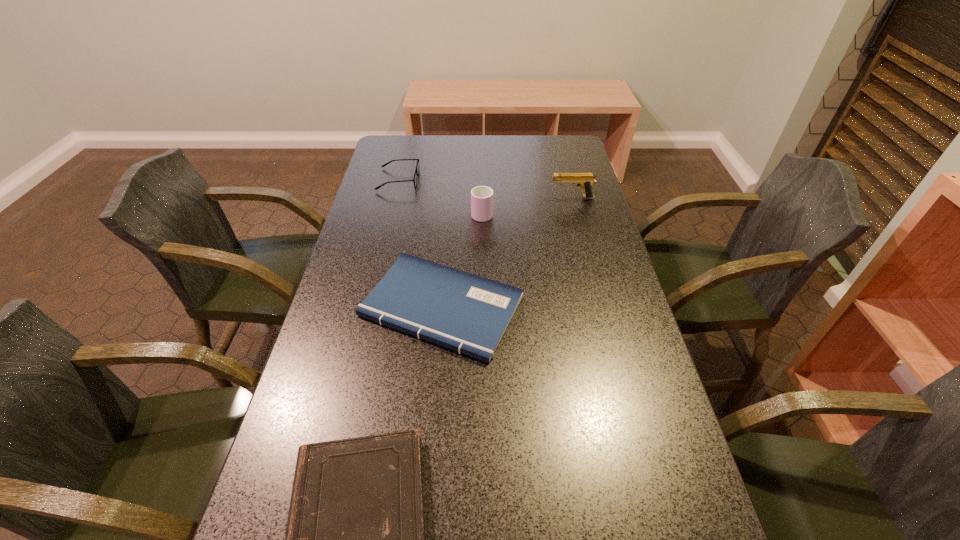
Locate an element on the screen. This screenshot has width=960, height=540. the second farthest object is located at coordinates (585, 181).

Image resolution: width=960 pixels, height=540 pixels. Find the location of `pistol`. pistol is located at coordinates (585, 181).

The height and width of the screenshot is (540, 960). What are the coordinates of `cup` in the screenshot? It's located at (481, 196).

Locate an element on the screen. spectacles is located at coordinates (416, 173).

Find the location of a particular element. the third tallest object is located at coordinates (416, 173).

I want to click on the farther paperback book, so click(461, 311).

Locate an element on the screen. The height and width of the screenshot is (540, 960). free space located at the barrel of the pistol is located at coordinates (514, 198).

At what (x,y) coordinates should I click in order to perform the action: click on vacant space located at the barrel of the pistol. Please return your answer as a coordinate pair (x, y). Looking at the image, I should click on (535, 198).

Where is `vacant space located 0.120m at the barrel of the pistol`? This screenshot has height=540, width=960. vacant space located 0.120m at the barrel of the pistol is located at coordinates (514, 198).

At what (x,y) coordinates should I click in order to perform the action: click on free region located with the handle on the side of the cup. Please return your answer as a coordinate pair (x, y). Looking at the image, I should click on (482, 171).